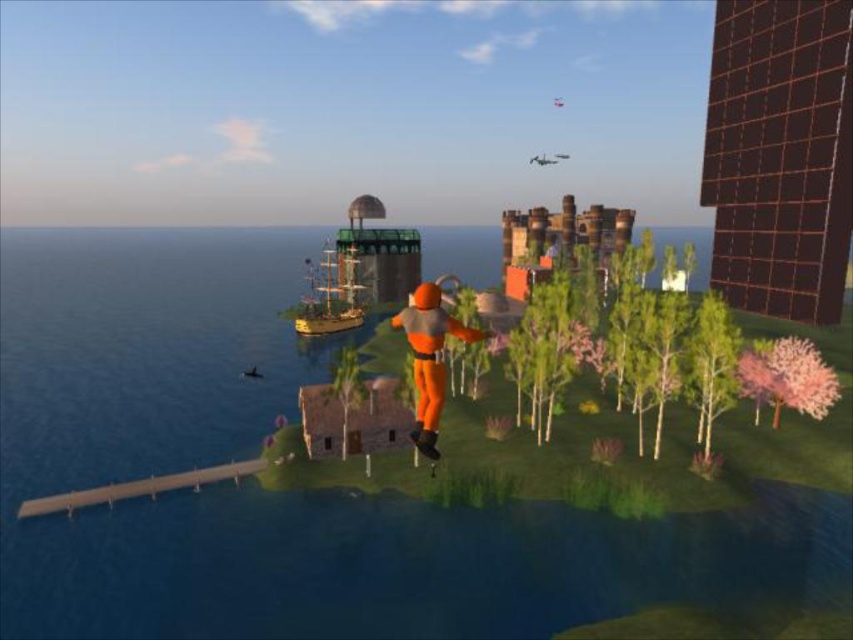
Does orange matte jumpsuit at center have a larger size compared to green matte tree at lower right?

Yes, orange matte jumpsuit at center is bigger than green matte tree at lower right.

Who is lower down, orange matte jumpsuit at center or green matte tree at lower right?

green matte tree at lower right is lower down.

Is point (412, 356) farther from camera compared to point (706, 412)?

No, it is not.

Image resolution: width=853 pixels, height=640 pixels. In order to click on orange matte jumpsuit at center in this screenshot , I will do `click(428, 358)`.

Is transparent blue water at center thinner than green matte tree at center?

No.

Does point (466, 538) come farther from viewer compared to point (352, 355)?

No, it is not.

This screenshot has width=853, height=640. What do you see at coordinates (299, 492) in the screenshot? I see `transparent blue water at center` at bounding box center [299, 492].

At what (x,y) coordinates should I click in order to perform the action: click on transparent blue water at center. Please return your answer as a coordinate pair (x, y). This screenshot has height=640, width=853. Looking at the image, I should click on (299, 492).

Who is higher up, transparent blue water at center or green matte tree at lower right?

transparent blue water at center is higher up.

Measure the distance between transparent blue water at center and green matte tree at lower right.

transparent blue water at center and green matte tree at lower right are 32.19 meters apart from each other.

The height and width of the screenshot is (640, 853). What do you see at coordinates (299, 492) in the screenshot? I see `transparent blue water at center` at bounding box center [299, 492].

Where is `transparent blue water at center`? This screenshot has height=640, width=853. transparent blue water at center is located at coordinates (299, 492).